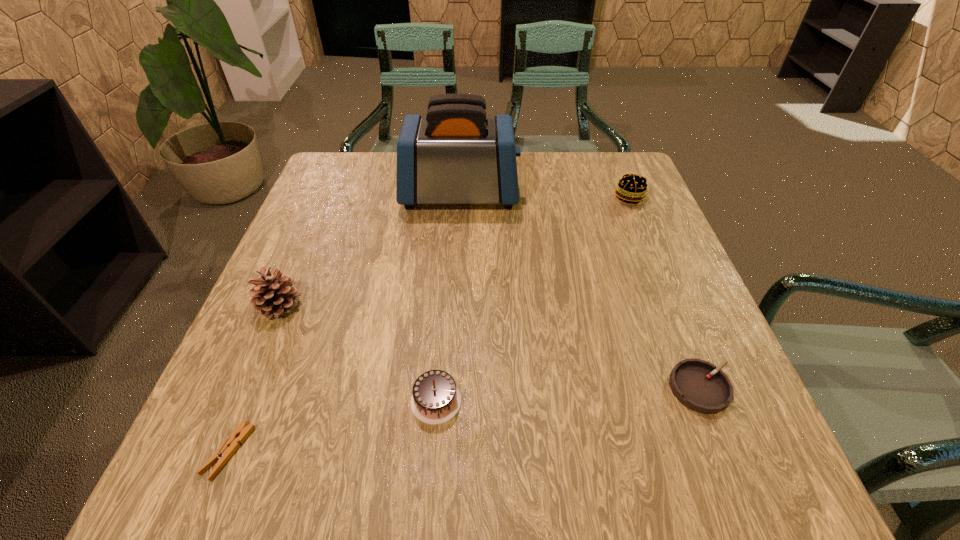
Where is `free space between the chocolate cake and the shortest object`? The width and height of the screenshot is (960, 540). free space between the chocolate cake and the shortest object is located at coordinates (332, 426).

At what (x,y) coordinates should I click in order to perform the action: click on free space between the ashtray and the fourth nearest object. Please return your answer as a coordinate pair (x, y). Image resolution: width=960 pixels, height=540 pixels. Looking at the image, I should click on (491, 347).

Identify the location of vacant region between the patty and the chocolate cake. (533, 300).

This screenshot has width=960, height=540. Identify the location of vacant area that lies between the clothespin and the chocolate cake. (332, 426).

Where is `vacant point located between the ashtray and the shortest object`? This screenshot has width=960, height=540. vacant point located between the ashtray and the shortest object is located at coordinates (465, 420).

Locate an element on the screen. vacant area that lies between the ashtray and the fourth nearest object is located at coordinates (491, 347).

Where is `free spot between the shortest object and the patty`? The image size is (960, 540). free spot between the shortest object and the patty is located at coordinates (429, 325).

You are a GUI agent. You are given a task and a screenshot of the screen. Output one action in this format:
    pyautogui.click(x=<x>, y=<y>)
    Task: Click on the blank region between the toaster and the patty
    Image resolution: width=960 pixels, height=540 pixels.
    Given the screenshot: What is the action you would take?
    (x=544, y=196)

Select which object is the fifth closest to the clothespin. Please provide its 2D coordinates. Your answer should be formatted as a tuple, i.e. [(x, y)], where the tuple contains the x and y coordinates of a point satisfying the conditions above.

[(631, 188)]

Locate an element on the screen. object that stands as the closest to the chocolate cake is located at coordinates (231, 444).